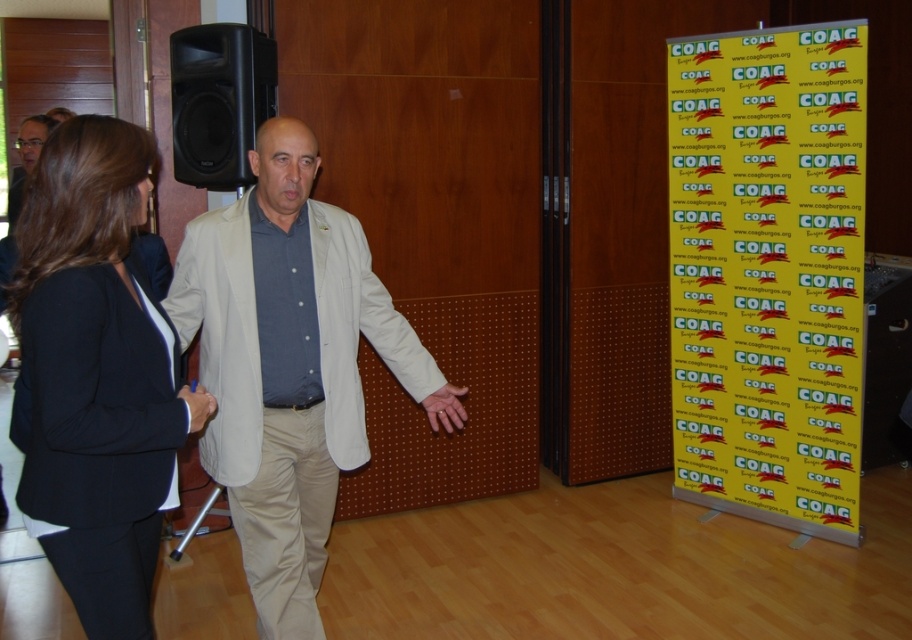
Does black fabric suit at left appear on the right side of smooth beige hand at center?

No, black fabric suit at left is not to the right of smooth beige hand at center.

Which is below, black fabric suit at left or smooth beige hand at center?

smooth beige hand at center

Is point (87, 186) behind point (451, 394)?

No, it is not.

At what (x,y) coordinates should I click in order to perform the action: click on black fabric suit at left. Please return your answer as a coordinate pair (x, y). Looking at the image, I should click on click(x=95, y=372).

Between black plastic speaker at upper left and matte black jacket at upper left, which one appears on the left side from the viewer's perspective?

matte black jacket at upper left

Which of these two, black plastic speaker at upper left or matte black jacket at upper left, stands shorter?

matte black jacket at upper left is shorter.

Who is more distant from viewer, (183, 161) or (37, 156)?

Point (183, 161)

Locate an element on the screen. This screenshot has height=640, width=912. black plastic speaker at upper left is located at coordinates (219, 100).

Who is taller, yellow paper at right or matte black jacket at upper left?

yellow paper at right

Is yellow paper at right bigger than matte black jacket at upper left?

Indeed, yellow paper at right has a larger size compared to matte black jacket at upper left.

Identify the location of yellow paper at right. point(768,273).

Identify the location of yellow paper at right. (768, 273).